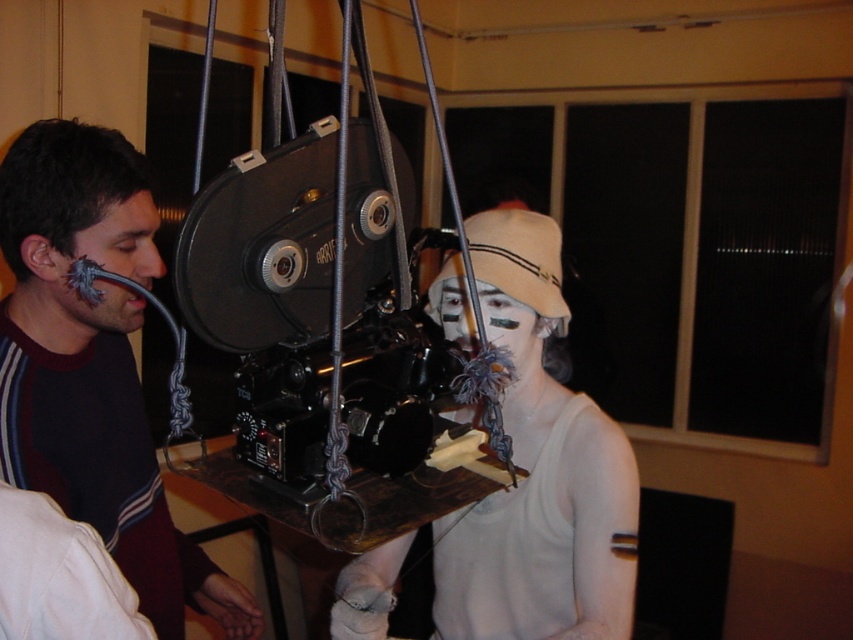
Question: Considering the real-world distances, which object is farthest from the white matte face at center?

Choices:
 (A) matte black face at left
 (B) matte black shirt at center

Answer: (B)

Question: From the image, what is the correct spatial relationship of matte black shirt at center in relation to white matte face at center?

Choices:
 (A) right
 (B) left

Answer: (B)

Question: Based on their relative distances, which object is farther from the matte black face at left?

Choices:
 (A) matte black shirt at center
 (B) white matte face at center

Answer: (B)

Question: Which object is positioned farthest from the matte black shirt at center?

Choices:
 (A) matte black face at left
 (B) white matte face at center

Answer: (B)

Question: Can you confirm if matte black shirt at center is bigger than white matte face at center?

Choices:
 (A) no
 (B) yes

Answer: (B)

Question: Does matte black shirt at center appear over white matte face at center?

Choices:
 (A) yes
 (B) no

Answer: (B)